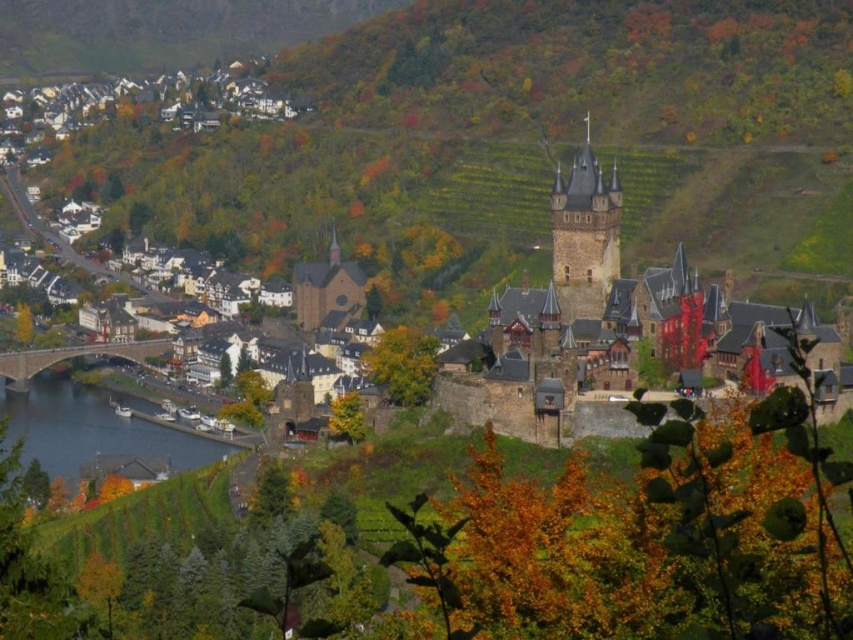
This screenshot has height=640, width=853. What do you see at coordinates (618, 330) in the screenshot? I see `dark brown stone castle at right` at bounding box center [618, 330].

Find the location of a particular element. The image size is (853, 640). dark brown stone castle at right is located at coordinates (618, 330).

This screenshot has width=853, height=640. Describe the element at coordinates (618, 330) in the screenshot. I see `dark brown stone castle at right` at that location.

Image resolution: width=853 pixels, height=640 pixels. I want to click on dark brown stone castle at right, so click(618, 330).

Can you confirm if blue water at lower left is bigger than stone bridge at lower left?

Indeed, blue water at lower left has a larger size compared to stone bridge at lower left.

Where is `blue water at lower left`? The width and height of the screenshot is (853, 640). blue water at lower left is located at coordinates (97, 429).

Can you confirm if blue water at lower left is thinner than dark brown stone tower at upper right?

No, blue water at lower left is not thinner than dark brown stone tower at upper right.

Between blue water at lower left and dark brown stone tower at upper right, which one has more height?

Standing taller between the two is dark brown stone tower at upper right.

Who is more distant from viewer, (x=106, y=456) or (x=566, y=257)?

The point (x=106, y=456) is more distant.

I want to click on blue water at lower left, so click(x=97, y=429).